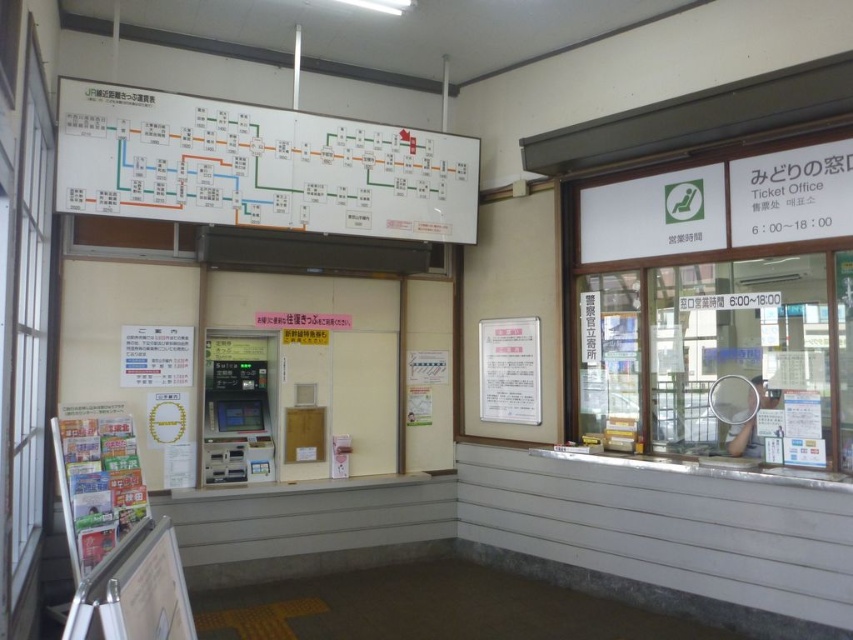
Question: Does white glass window at right appear on the left side of white paper map at upper center?

Choices:
 (A) yes
 (B) no

Answer: (B)

Question: Which of the following is the closest to the observer?

Choices:
 (A) metallic gray atm at center
 (B) white glass window at right
 (C) white paper map at upper center

Answer: (B)

Question: Considering the real-world distances, which object is farthest from the metallic gray atm at center?

Choices:
 (A) white paper map at upper center
 (B) white glass window at right

Answer: (B)

Question: Among these points, which one is farthest from the camera?

Choices:
 (A) (219, 152)
 (B) (708, 248)

Answer: (A)

Question: Does white paper map at upper center have a lesser width compared to metallic gray atm at center?

Choices:
 (A) yes
 (B) no

Answer: (B)

Question: Does white glass window at right appear on the left side of white paper map at upper center?

Choices:
 (A) no
 (B) yes

Answer: (A)